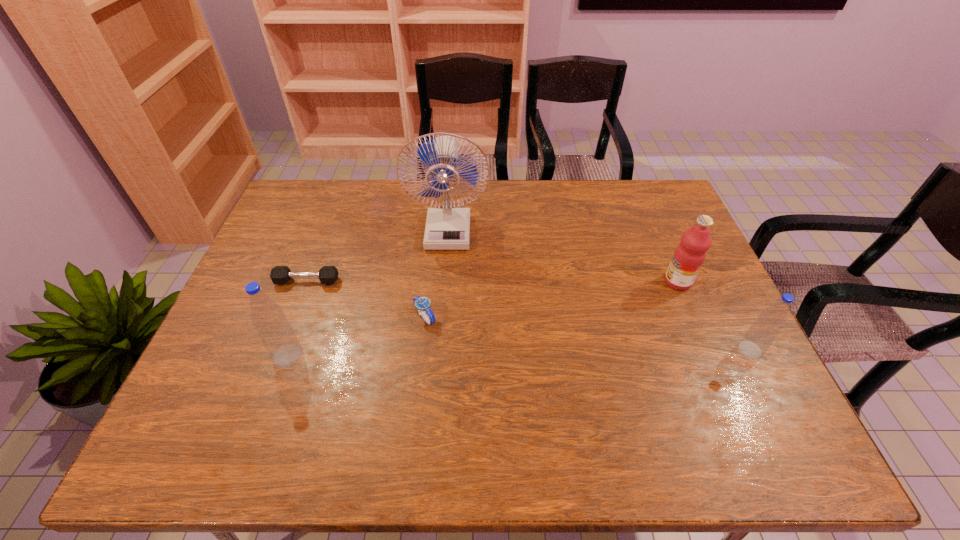
Image resolution: width=960 pixels, height=540 pixels. What are the coordinates of `vacant spot for a new water_bottle to ensure equal spacing` in the screenshot? It's located at (520, 353).